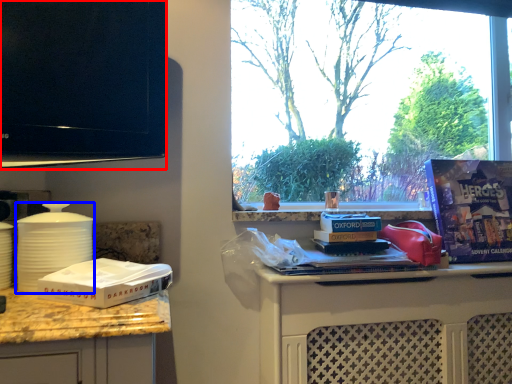
Question: Among these objects, which one is farthest to the camera, television (highlighted by a red box) or kitchen appliance (highlighted by a blue box)?

Choices:
 (A) television
 (B) kitchen appliance

Answer: (A)